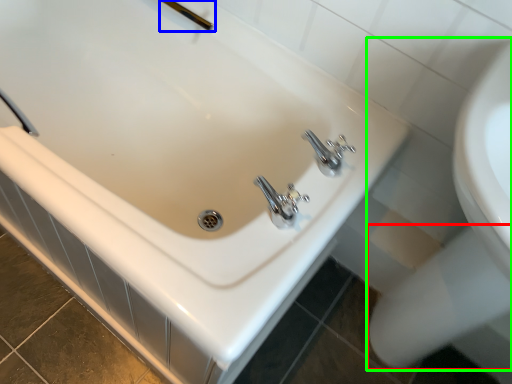
Question: Which object is the closest to the bidet (highlighted by a red box)? Choose among these: shower (highlighted by a blue box) or sink (highlighted by a green box).

Choices:
 (A) shower
 (B) sink

Answer: (B)